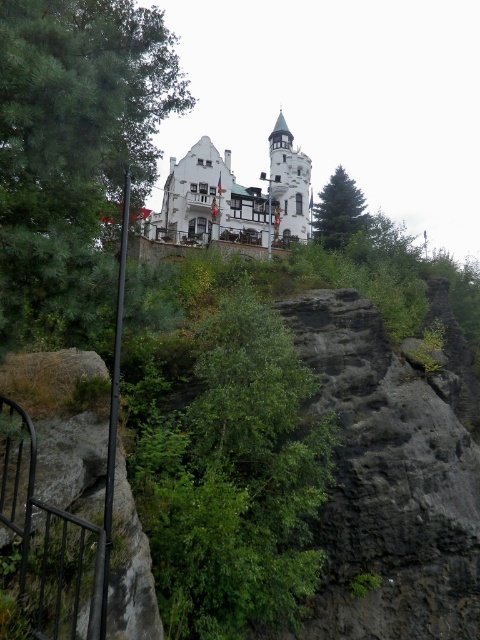
You are standing at the viewpoint below the white stone castle at center and want to take a photo of it. However, the green leafy tree at left is blocking part of the castle. Can you estimate whether the tree is thinner than the castle to determine if moving closer might help reduce the obstruction?

The green leafy tree at left is thinner than the white stone castle at center, so moving closer might reduce the obstruction since the tree is narrower and could allow more of the castle to be visible.

You are standing at the viewpoint below the castle and want to take a photo of the white stone castle at center. However, you notice the green matte tree at upper center might block your view. Based on the scene, will the tree obstruct the castle in your photo?

The white stone castle at center is in front of the green matte tree at upper center, so the castle will block the tree in the photo, meaning the tree will not obstruct the castle.